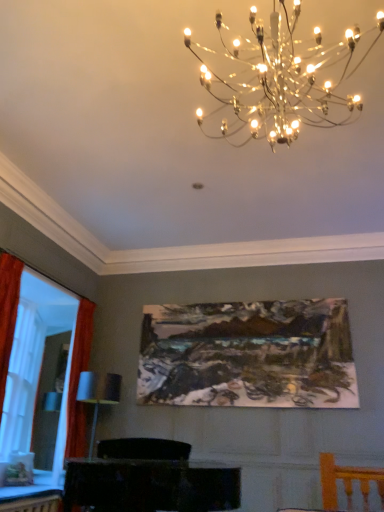
Question: Is matte orange curtain at left shorter than oil painting at center?

Choices:
 (A) yes
 (B) no

Answer: (B)

Question: Is matte orange curtain at left turned away from oil painting at center?

Choices:
 (A) no
 (B) yes

Answer: (A)

Question: Can you confirm if matte orange curtain at left is taller than oil painting at center?

Choices:
 (A) no
 (B) yes

Answer: (B)

Question: Can you confirm if matte orange curtain at left is positioned to the left of oil painting at center?

Choices:
 (A) yes
 (B) no

Answer: (A)

Question: From the image's perspective, is matte orange curtain at left above oil painting at center?

Choices:
 (A) no
 (B) yes

Answer: (A)

Question: From a real-world perspective, is matte orange curtain at left on oil painting at center?

Choices:
 (A) no
 (B) yes

Answer: (A)

Question: From the image's perspective, is metallic chandelier at upper center over oil painting at center?

Choices:
 (A) no
 (B) yes

Answer: (B)

Question: Is metallic chandelier at upper center far from oil painting at center?

Choices:
 (A) no
 (B) yes

Answer: (B)

Question: Are metallic chandelier at upper center and oil painting at center beside each other?

Choices:
 (A) no
 (B) yes

Answer: (A)

Question: Could you tell me if metallic chandelier at upper center is turned towards oil painting at center?

Choices:
 (A) yes
 (B) no

Answer: (B)

Question: Is metallic chandelier at upper center not within oil painting at center?

Choices:
 (A) yes
 (B) no

Answer: (A)

Question: Is metallic chandelier at upper center taller than oil painting at center?

Choices:
 (A) yes
 (B) no

Answer: (B)

Question: Does oil painting at center have a greater width compared to matte black cabinet at lower center?

Choices:
 (A) yes
 (B) no

Answer: (B)